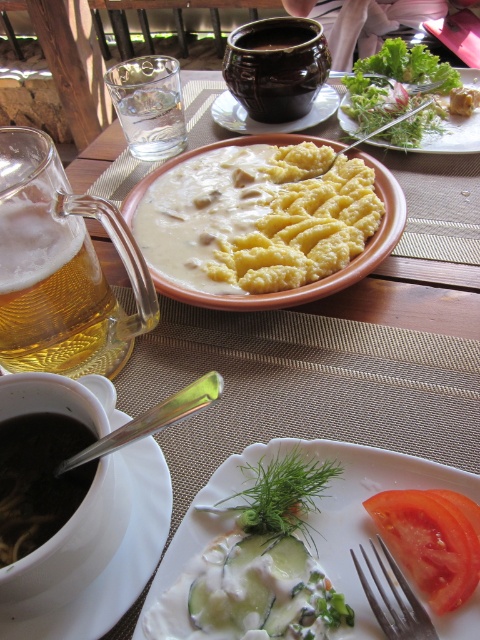
This screenshot has height=640, width=480. I want to click on black matte soup at lower left, so click(x=38, y=480).

Does point (12, 547) come in front of point (380, 621)?

No, it is behind (380, 621).

Who is more distant from viewer, (36, 488) or (398, 636)?

Positioned behind is point (36, 488).

Locate an element on the screen. Image resolution: width=480 pixels, height=640 pixels. black matte soup at lower left is located at coordinates coord(38,480).

Is black matte soup at lower left smaller than green leafy salad at center?

Yes.

Identify the location of black matte soup at lower left. The image size is (480, 640). (38, 480).

Does point (39, 243) come behind point (462, 77)?

No, (39, 243) is closer to viewer.

Looking at this image, is foamy golden beer at left further to camera compared to green leafy salad at center?

No.

This screenshot has height=640, width=480. Find the location of `foamy golden beer at left`. foamy golden beer at left is located at coordinates (55, 298).